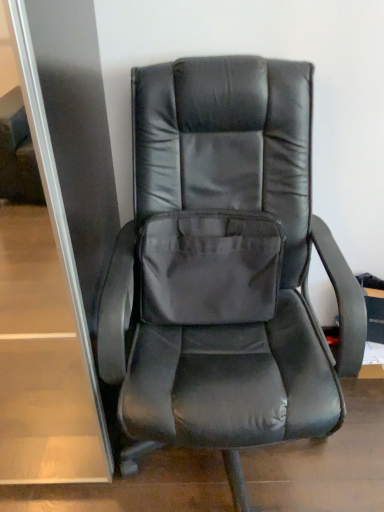
Question: In terms of width, does matte black chair at center look wider or thinner when compared to gray fabric pocket at center?

Choices:
 (A) thin
 (B) wide

Answer: (B)

Question: Visually, is matte black chair at center positioned to the left or to the right of gray fabric pocket at center?

Choices:
 (A) left
 (B) right

Answer: (B)

Question: In the image, is matte black chair at center positioned in front of or behind gray fabric pocket at center?

Choices:
 (A) front
 (B) behind

Answer: (A)

Question: From a real-world perspective, is gray fabric pocket at center positioned above or below matte black chair at center?

Choices:
 (A) below
 (B) above

Answer: (B)

Question: Do you think gray fabric pocket at center is within matte black chair at center, or outside of it?

Choices:
 (A) outside
 (B) inside

Answer: (B)

Question: Is gray fabric pocket at center taller or shorter than matte black chair at center?

Choices:
 (A) short
 (B) tall

Answer: (A)

Question: Considering the positions of gray fabric pocket at center and matte black chair at center in the image, is gray fabric pocket at center wider or thinner than matte black chair at center?

Choices:
 (A) thin
 (B) wide

Answer: (A)